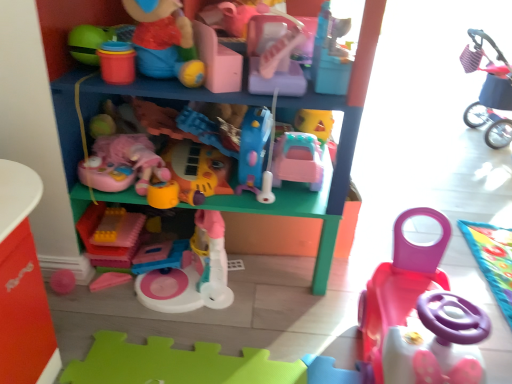
Locate an element on the screen. unoccupied region to the right of translucent yellow plastic blocks at center, placed as the eighth toy when sorted from right to left is located at coordinates (159, 249).